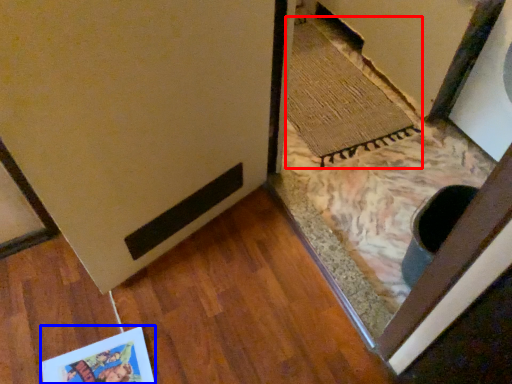
Question: Which object is further to the camera taking this photo, doormat (highlighted by a red box) or postcard (highlighted by a blue box)?

Choices:
 (A) doormat
 (B) postcard

Answer: (A)